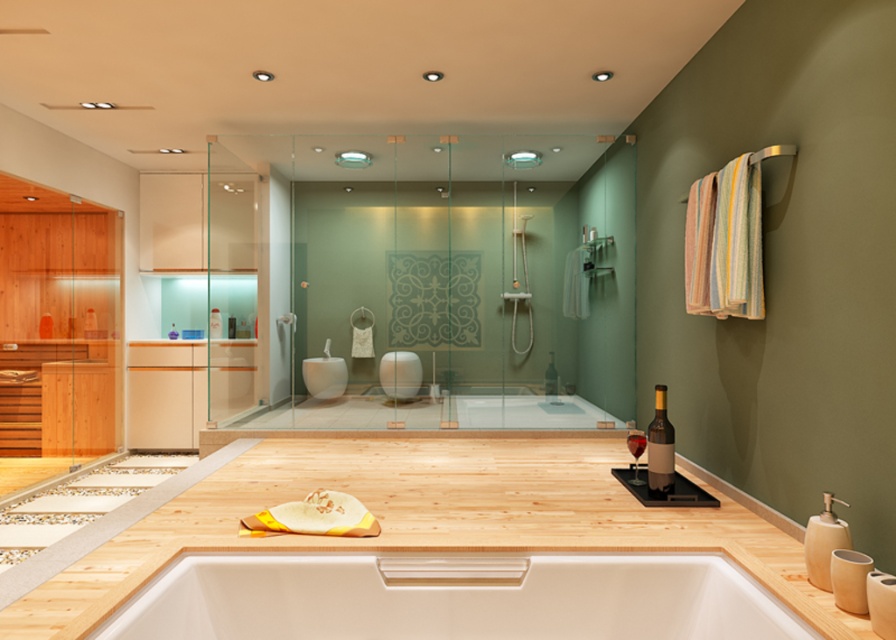
You are planning to place a decorative item that requires a surface area of 1 square meter. Given the white glossy jacuzzi at lower center and the dark glass wine at center, which object would be more suitable for placing the item?

The white glossy jacuzzi at lower center has a larger width than the dark glass wine at center, making it more suitable for placing the decorative item requiring 1 square meter of surface area.